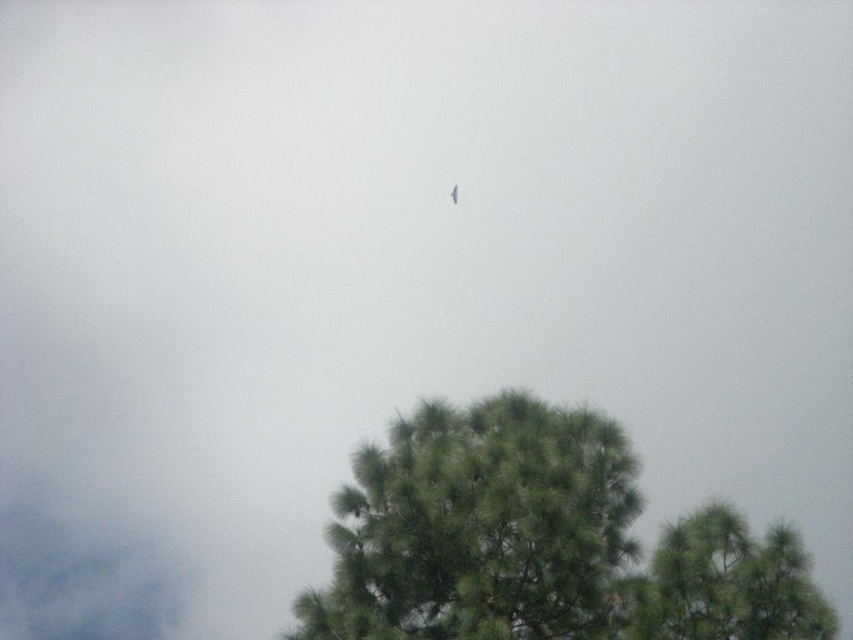
Question: Based on their relative distances, which object is nearer to the green fuzzy tree at center?

Choices:
 (A) dark gray feathered bird at center
 (B) gray fluffy cloud at upper left

Answer: (A)

Question: Which of the following is the farthest from the observer?

Choices:
 (A) gray fluffy cloud at upper left
 (B) dark gray feathered bird at center

Answer: (A)

Question: Can you confirm if green fuzzy tree at center is thinner than dark gray feathered bird at center?

Choices:
 (A) yes
 (B) no

Answer: (B)

Question: Is green fuzzy tree at center below dark gray feathered bird at center?

Choices:
 (A) no
 (B) yes

Answer: (B)

Question: Is green fuzzy tree at center closer to the viewer compared to gray fluffy cloud at upper left?

Choices:
 (A) yes
 (B) no

Answer: (A)

Question: Which object is farther from the camera taking this photo?

Choices:
 (A) green fuzzy tree at center
 (B) dark gray feathered bird at center

Answer: (B)